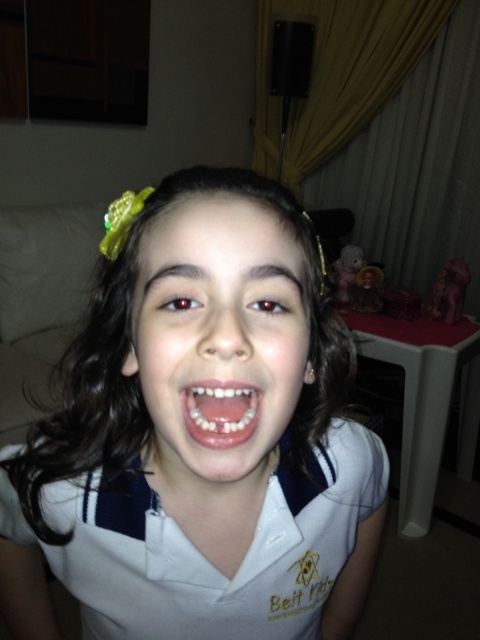
Question: Does white matte school uniform at center appear on the right side of smooth skin face at center?

Choices:
 (A) no
 (B) yes

Answer: (A)

Question: Is white glossy shirt at center below white glossy teeth at center?

Choices:
 (A) no
 (B) yes

Answer: (B)

Question: Estimate the real-world distances between objects in this image. Which object is farther from the smooth skin face at center?

Choices:
 (A) white glossy teeth at center
 (B) white matte school uniform at center

Answer: (B)

Question: Can you confirm if white glossy shirt at center is wider than white glossy teeth at center?

Choices:
 (A) no
 (B) yes

Answer: (B)

Question: Which point is closer to the camera?

Choices:
 (A) pyautogui.click(x=219, y=316)
 (B) pyautogui.click(x=199, y=429)
 (C) pyautogui.click(x=48, y=547)
 (D) pyautogui.click(x=295, y=285)

Answer: (A)

Question: Which object appears farthest from the camera in this image?

Choices:
 (A) white glossy teeth at center
 (B) smooth skin face at center
 (C) white matte school uniform at center

Answer: (C)